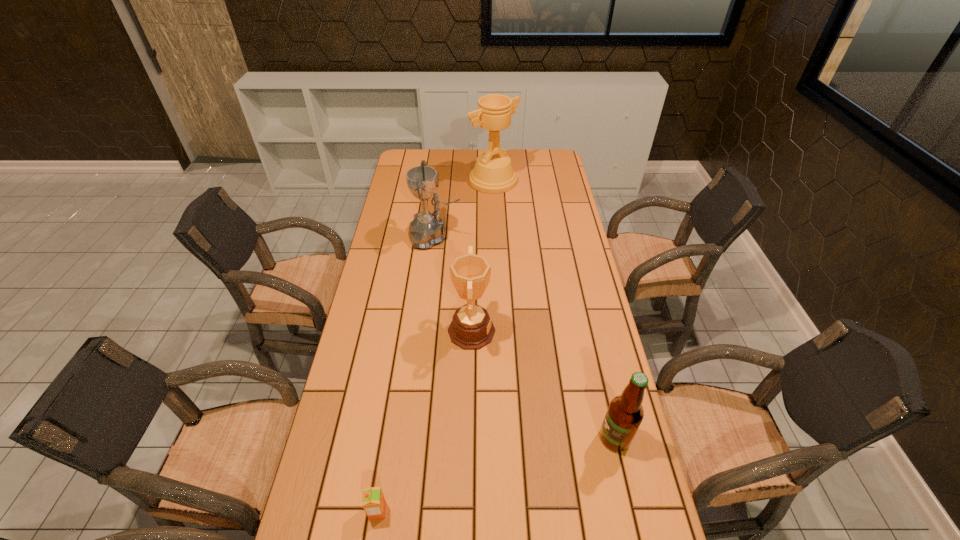
Find the location of a particular element. Image resolution: width=960 pixels, height=540 pixels. blank space located 0.160m on the front-facing side of the nearest award is located at coordinates (546, 332).

Locate an element on the screen. This screenshot has width=960, height=540. vacant space located 0.200m on the label of the beer bottle is located at coordinates (521, 438).

Locate an element on the screen. The image size is (960, 540). free location located on the label of the beer bottle is located at coordinates (452, 438).

Find the location of `vacant space situated on the label of the beer bottle`. vacant space situated on the label of the beer bottle is located at coordinates (525, 438).

The width and height of the screenshot is (960, 540). I want to click on vacant space located 0.070m on the right of the orange juice, so click(x=417, y=511).

Where is `object that is at the far edge`? This screenshot has height=540, width=960. object that is at the far edge is located at coordinates (493, 173).

At what (x,y) coordinates should I click in order to perform the action: click on award located at the left edge. Please return your answer as a coordinate pair (x, y). This screenshot has height=540, width=960. Looking at the image, I should click on (427, 229).

In order to click on orange juice that is at the left edge in this screenshot , I will do `click(374, 504)`.

This screenshot has height=540, width=960. Find the location of `object located in the right edge section of the desktop`. object located in the right edge section of the desktop is located at coordinates (625, 413).

Where is `free space at the far edge of the desktop`? free space at the far edge of the desktop is located at coordinates (523, 167).